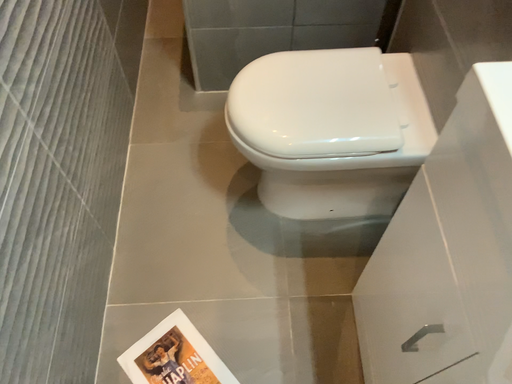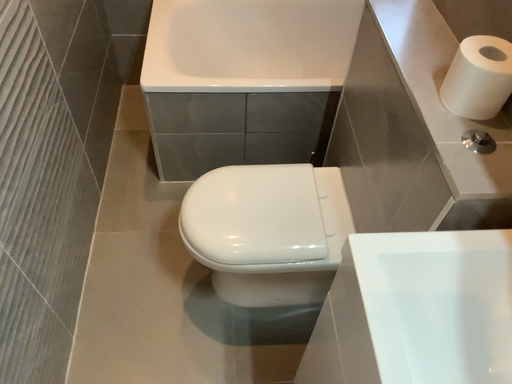
Question: How did the camera likely rotate when shooting the video?

Choices:
 (A) rotated downward
 (B) rotated upward

Answer: (B)